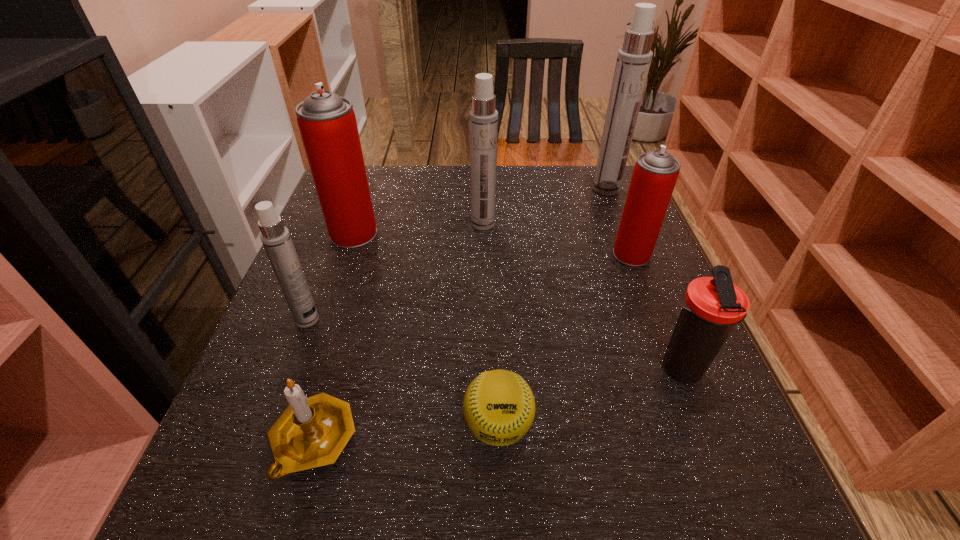
Locate an element on the screen. The image size is (960, 540). free point at the right edge is located at coordinates (638, 347).

The image size is (960, 540). I want to click on free space at the far left corner of the desktop, so click(x=372, y=173).

Identify the location of vacant region at the near left corner. (244, 528).

Locate an element on the screen. The width and height of the screenshot is (960, 540). unoccupied area between the farthest object and the gold candle holder is located at coordinates (460, 315).

This screenshot has width=960, height=540. Identify the location of free area in between the rightmost white aerosol can and the third aerosol can from left to right. (544, 206).

The width and height of the screenshot is (960, 540). Find the location of `vacant region between the nearest aerosol can and the candle holder`. vacant region between the nearest aerosol can and the candle holder is located at coordinates (310, 380).

Image resolution: width=960 pixels, height=540 pixels. I want to click on empty location between the brown thermos bottle and the right red aerosol can, so click(656, 312).

The height and width of the screenshot is (540, 960). In order to click on free space between the left red aerosol can and the smaller red aerosol can in this screenshot , I will do `click(492, 244)`.

Locate an element on the screen. The width and height of the screenshot is (960, 540). free spot between the brown thermos bottle and the softball is located at coordinates (588, 397).

Locate an element on the screen. The image size is (960, 540). unoccupied position between the right red aerosol can and the thermos bottle is located at coordinates (656, 312).